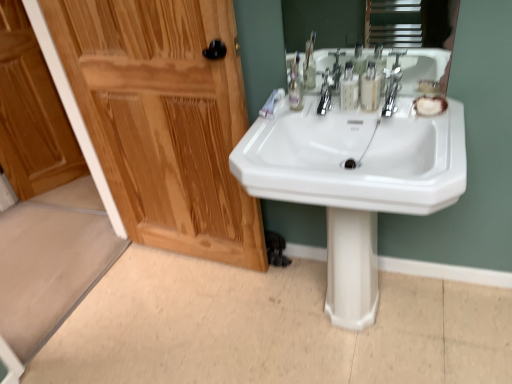
Find the location of a particular element. The height and width of the screenshot is (384, 512). free spot to the right of translucent plastic mouthwash at center, which is the second mouthwash from left to right is located at coordinates (408, 106).